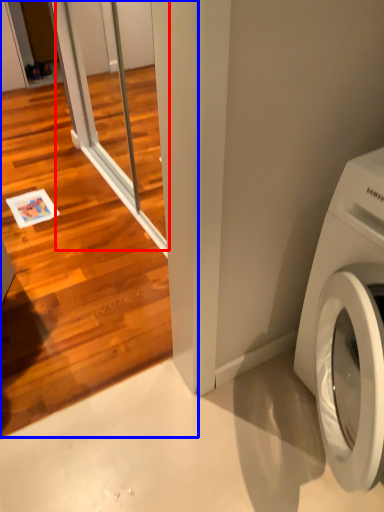
Question: Which object is closer to the camera taking this photo, screen door (highlighted by a red box) or screen door (highlighted by a blue box)?

Choices:
 (A) screen door
 (B) screen door

Answer: (B)